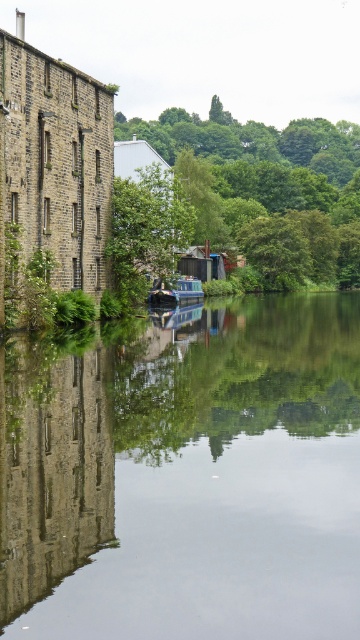
Based on the photo, can you confirm if smooth reflective water at center is positioned above green leafy tree at upper center?

Incorrect, smooth reflective water at center is not positioned above green leafy tree at upper center.

Can you confirm if smooth reflective water at center is taller than green leafy tree at upper center?

No.

Which is behind, point (180, 632) or point (349, 266)?

The point (349, 266) is more distant.

In order to click on smooth reflective water at center in this screenshot , I will do `click(186, 476)`.

Who is more distant from viewer, (183, 234) or (203, 296)?

Positioned behind is point (203, 296).

In the scene shown: Measure the distance from green leafy tree at center to blue glossy canal boat at center.

A distance of 10.71 meters exists between green leafy tree at center and blue glossy canal boat at center.

At what (x,y) coordinates should I click in order to perform the action: click on green leafy tree at center. Please return your answer as a coordinate pair (x, y). The image size is (360, 640). Looking at the image, I should click on (146, 230).

Is point (25, 608) farther from viewer compared to point (169, 180)?

No, (25, 608) is in front of (169, 180).

Does smooth reflective water at center appear on the left side of green leafy tree at center?

Incorrect, smooth reflective water at center is not on the left side of green leafy tree at center.

I want to click on smooth reflective water at center, so click(186, 476).

The width and height of the screenshot is (360, 640). I want to click on smooth reflective water at center, so click(x=186, y=476).